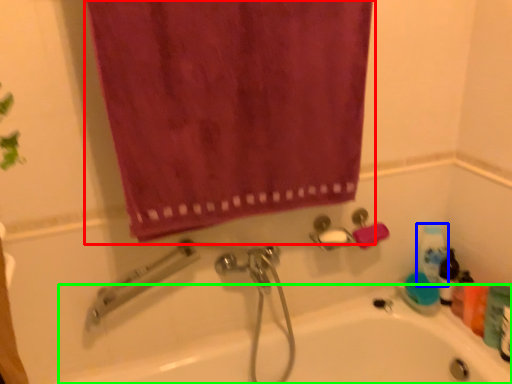
Question: Estimate the real-world distances between objects in this image. Which object is closer to curtain (highlighted by a red box), cleaning product (highlighted by a blue box) or bath (highlighted by a green box)?

Choices:
 (A) cleaning product
 (B) bath

Answer: (B)